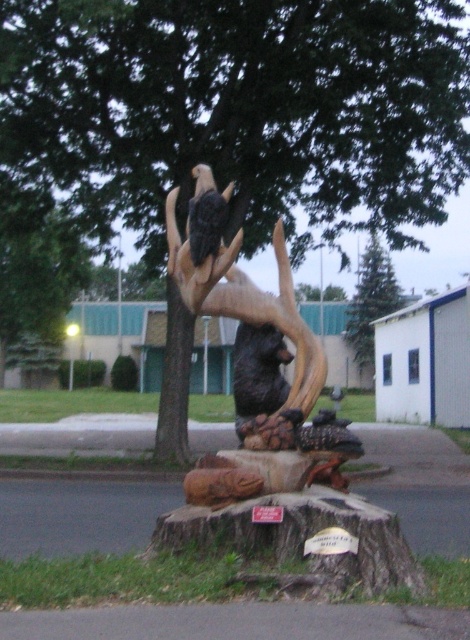
You are standing in the park and want to take a photo of both the wooden sculpture at center and the dark brown wood eagle at upper center in the same frame. Given that your camera has a maximum focus range of 12 meters, will you be able to capture both subjects clearly?

The wooden sculpture at center is 12.48 meters away from the dark brown wood eagle at upper center. Since the camera can only focus up to 12 meters, the distance between them exceeds the camera range, so you cannot capture both clearly in the same frame.

Based on the photo, you are a park visitor who wants to take a photo of the wooden sculpture at center and the dark brown wood eagle at upper center. Which object should you focus on first to ensure both are in the frame?

The wooden sculpture at center is positioned over the dark brown wood eagle at upper center, so focusing on the wooden sculpture at center first will ensure both are in the frame.